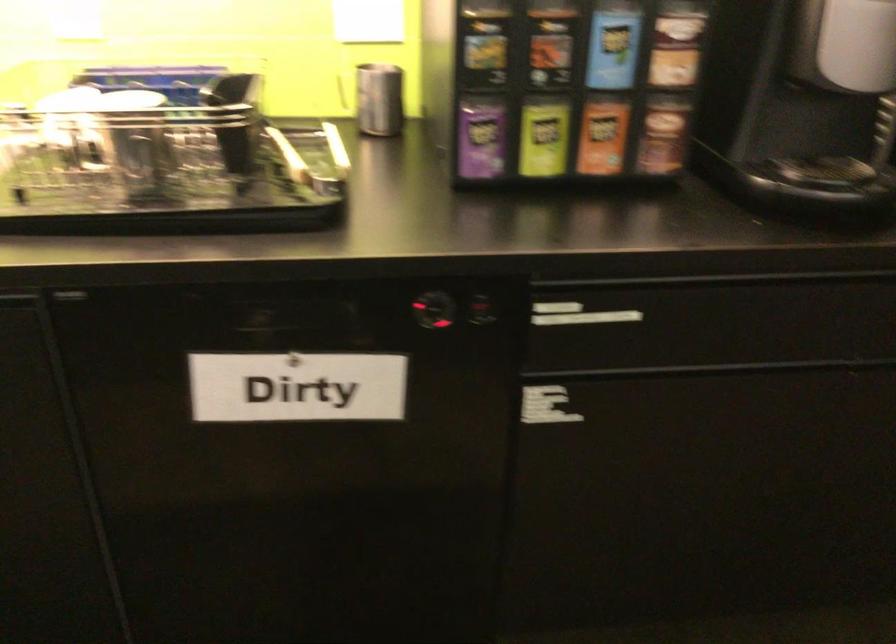
Locate an element on the screen. The height and width of the screenshot is (644, 896). silver utensil holder is located at coordinates (164, 156).